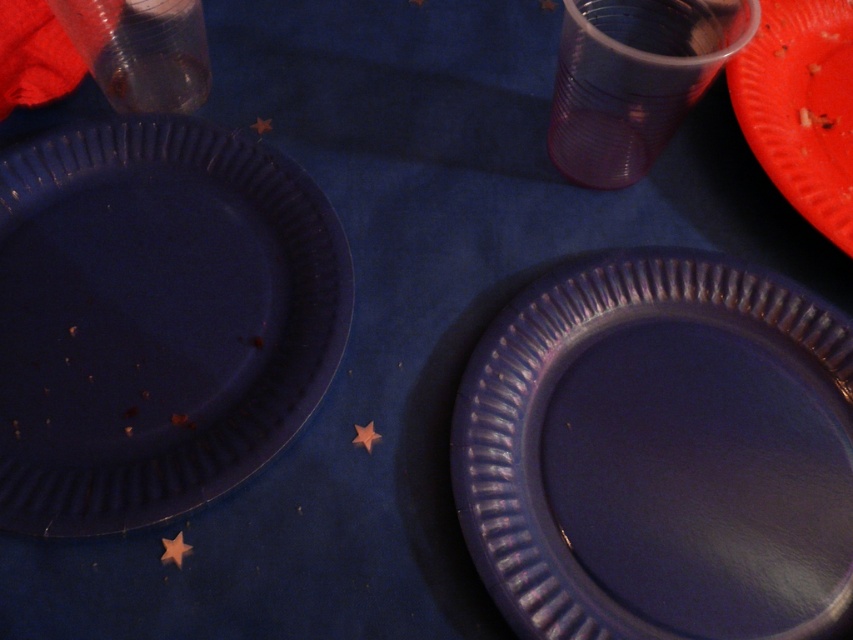
Where is `matte blue plate at lower right`? This screenshot has height=640, width=853. matte blue plate at lower right is located at coordinates (659, 452).

Between point (653, 609) and point (241, 202), which one is positioned behind?

The point (241, 202) is behind.

Between point (561, 621) and point (323, 353), which one is positioned behind?

Positioned behind is point (323, 353).

Locate an element on the screen. Image resolution: width=853 pixels, height=640 pixels. matte blue plate at lower right is located at coordinates (659, 452).

Is matte blue plate at lower right thinner than orange matte plate at upper right?

In fact, matte blue plate at lower right might be wider than orange matte plate at upper right.

Who is more distant from viewer, [567,604] or [834,177]?

Point [834,177]

Image resolution: width=853 pixels, height=640 pixels. I want to click on matte blue plate at lower right, so point(659,452).

The height and width of the screenshot is (640, 853). Identify the location of matte blue plate at lower left. (155, 320).

Who is lower down, matte blue plate at lower left or orange matte plate at upper right?

matte blue plate at lower left is lower down.

The width and height of the screenshot is (853, 640). What do you see at coordinates (155, 320) in the screenshot?
I see `matte blue plate at lower left` at bounding box center [155, 320].

You are a GUI agent. You are given a task and a screenshot of the screen. Output one action in this format:
    pyautogui.click(x=<x>, y=<y>)
    Task: Click on the matte blue plate at lower left
    Image resolution: width=853 pixels, height=640 pixels.
    Given the screenshot: What is the action you would take?
    pyautogui.click(x=155, y=320)